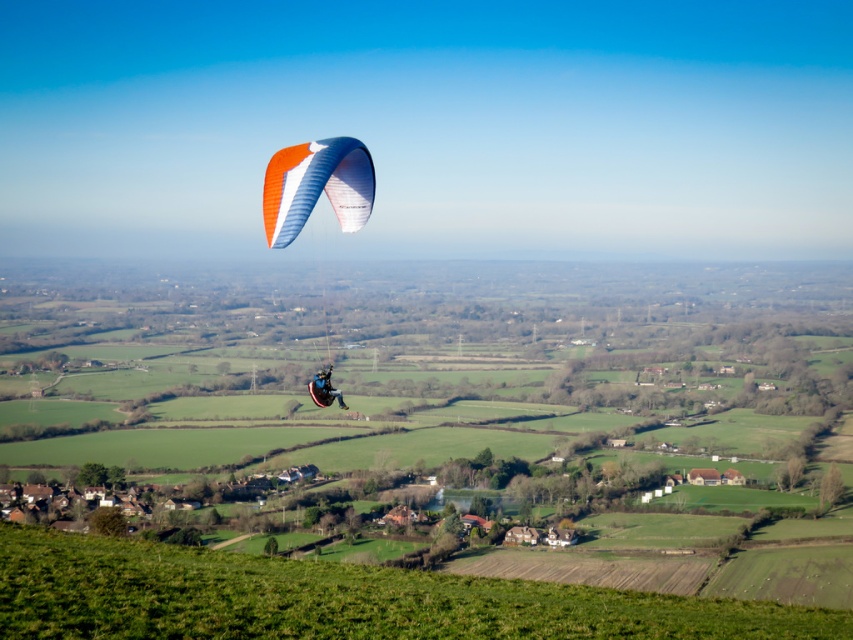
Question: Is green grassy field at center above matte blue paraglider at upper center?

Choices:
 (A) no
 (B) yes

Answer: (A)

Question: Which object is closer to the camera taking this photo?

Choices:
 (A) orange/white fabric parachute at center
 (B) matte blue paraglider at upper center

Answer: (B)

Question: From the image, what is the correct spatial relationship of orange/white fabric parachute at center in relation to matte blue paraglider at upper center?

Choices:
 (A) below
 (B) above

Answer: (B)

Question: Considering the real-world distances, which object is closest to the orange/white fabric parachute at center?

Choices:
 (A) matte blue paraglider at upper center
 (B) green grassy field at center

Answer: (A)

Question: Can you confirm if green grassy field at center is positioned to the right of matte blue paraglider at upper center?

Choices:
 (A) yes
 (B) no

Answer: (A)

Question: Which is farther from the matte blue paraglider at upper center?

Choices:
 (A) orange/white fabric parachute at center
 (B) green grassy field at center

Answer: (B)